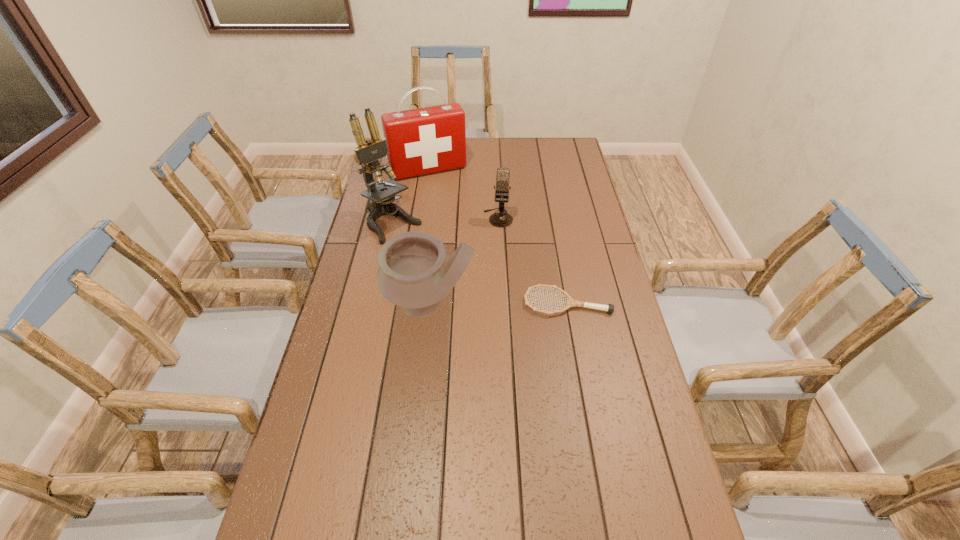
Where is `empty space between the fourth object from left to right and the rightmost object`? The image size is (960, 540). empty space between the fourth object from left to right and the rightmost object is located at coordinates (533, 260).

The height and width of the screenshot is (540, 960). I want to click on vacant area that lies between the fourth shortest object and the second shortest object, so click(x=464, y=194).

This screenshot has width=960, height=540. Find the location of `vacant space that's between the rightmost object and the microscope`. vacant space that's between the rightmost object and the microscope is located at coordinates (480, 264).

Where is `vacant point located between the microscope and the fourth shortest object`? vacant point located between the microscope and the fourth shortest object is located at coordinates (411, 197).

This screenshot has width=960, height=540. I want to click on object that is the third nearest to the third tallest object, so click(x=500, y=219).

Locate an element on the screen. This screenshot has width=960, height=540. the fourth closest object to the third tallest object is located at coordinates (422, 141).

You are a GUI agent. You are given a task and a screenshot of the screen. Output one action in this format:
    pyautogui.click(x=<x>, y=<y>)
    Task: Click on the free location that satisfies the following two spatial constraints: 1. on the back side of the pottery; 2. on the left side of the microphone
    
    Given the screenshot: What is the action you would take?
    pyautogui.click(x=439, y=218)